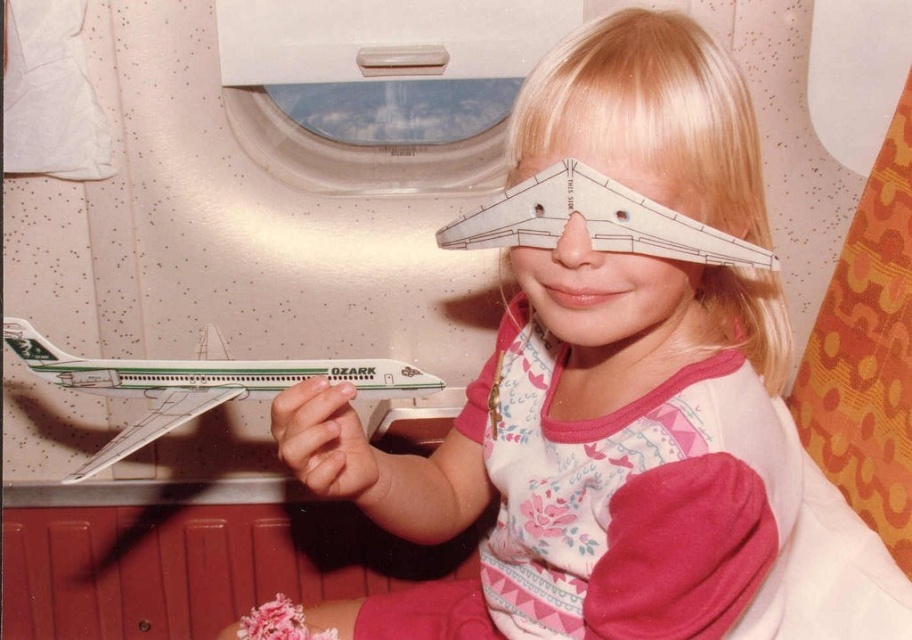
Question: Which point is farther from the camera taking this photo?

Choices:
 (A) (506, 480)
 (B) (185, 376)
 (C) (457, 13)

Answer: (C)

Question: Which of the following is the closest to the observer?

Choices:
 (A) green and white paper airplane at left
 (B) transparent plastic airplane window at upper center
 (C) pink fabric shirt at center

Answer: (C)

Question: Is pink fabric shirt at center positioned in front of transparent plastic airplane window at upper center?

Choices:
 (A) no
 (B) yes

Answer: (B)

Question: Does transparent plastic airplane window at upper center appear on the right side of green and white paper airplane at left?

Choices:
 (A) yes
 (B) no

Answer: (A)

Question: Does pink fabric shirt at center appear over green and white paper airplane at left?

Choices:
 (A) no
 (B) yes

Answer: (A)

Question: Among these objects, which one is farthest from the camera?

Choices:
 (A) transparent plastic airplane window at upper center
 (B) green and white paper airplane at left

Answer: (A)